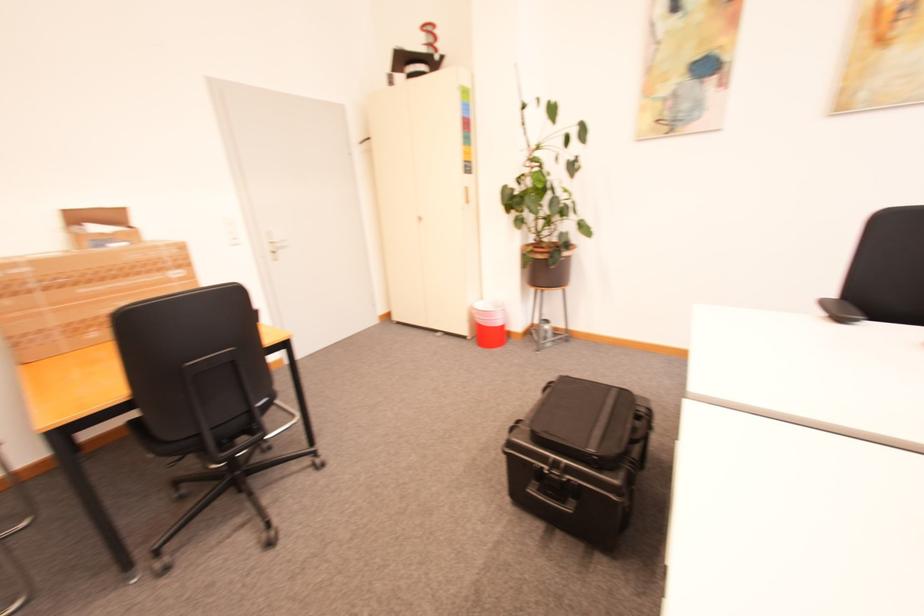
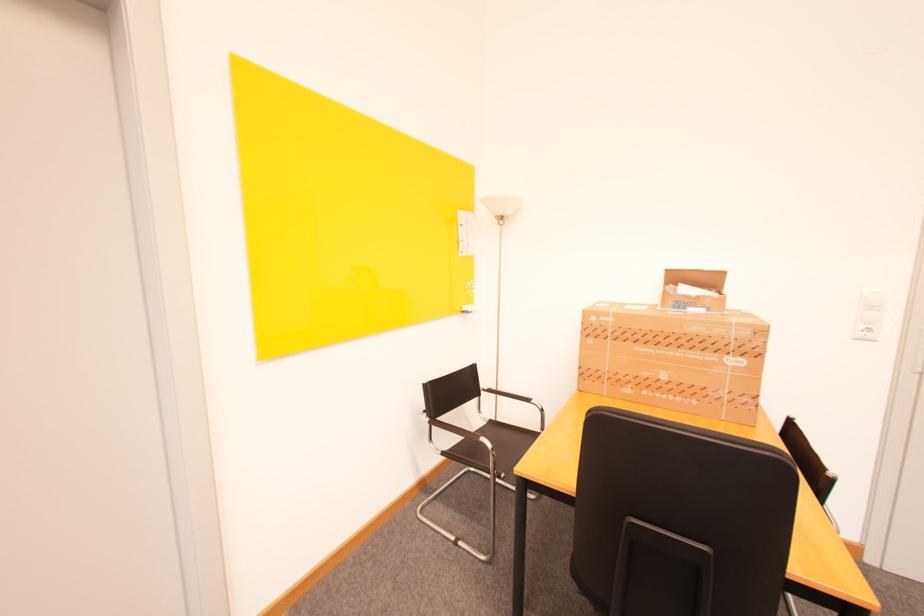
In the second image, find the point that corresponds to (x=89, y=291) in the first image.

(643, 349)